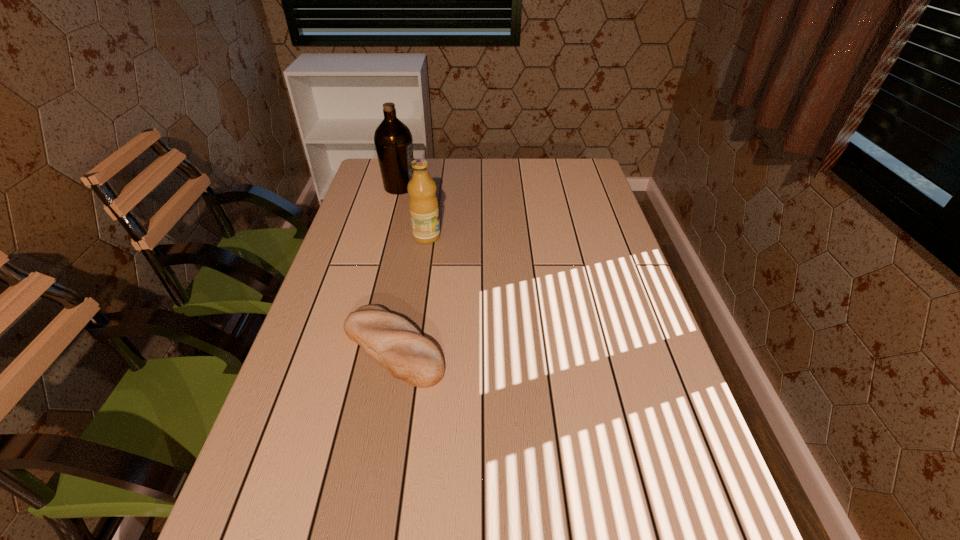
Select which object appears as the closest to the shorter olive oil. Please provide its 2D coordinates. Your answer should be formatted as a tuple, i.e. [(x, y)], where the tuple contains the x and y coordinates of a point satisfying the conditions above.

[(393, 141)]

Identify the location of vacant space that satisfies the following two spatial constraints: 1. on the label of the bread; 2. on the right side of the farther olive oil. (358, 348).

Locate an element on the screen. free space in the image that satisfies the following two spatial constraints: 1. on the back side of the bread; 2. on the label of the left olive oil is located at coordinates (423, 187).

Image resolution: width=960 pixels, height=540 pixels. Find the location of `vacant space that satisfies the following two spatial constraints: 1. on the back side of the shortest object; 2. on the label of the taller olive oil`. vacant space that satisfies the following two spatial constraints: 1. on the back side of the shortest object; 2. on the label of the taller olive oil is located at coordinates (423, 187).

Where is `free spot that satisfies the following two spatial constraints: 1. on the label of the taller olive oil; 2. on the left side of the nearest object`? The image size is (960, 540). free spot that satisfies the following two spatial constraints: 1. on the label of the taller olive oil; 2. on the left side of the nearest object is located at coordinates (358, 348).

Image resolution: width=960 pixels, height=540 pixels. I want to click on free spot that satisfies the following two spatial constraints: 1. on the label of the farthest object; 2. on the left side of the nearest object, so click(358, 348).